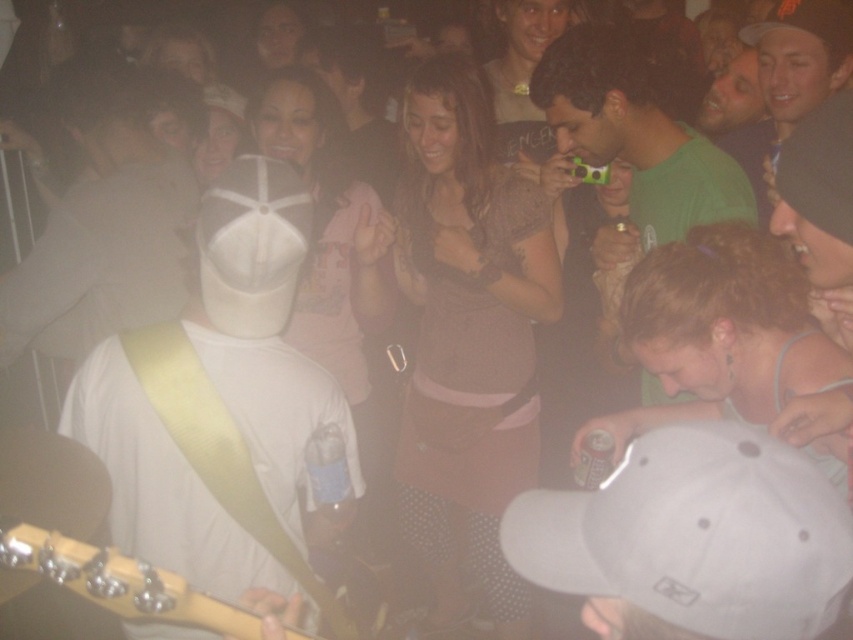
Between white fabric cap at center and smooth black cap at upper right, which one is positioned higher?

smooth black cap at upper right is above.

Is point (195, 493) positioned behind point (793, 29)?

No, (195, 493) is in front of (793, 29).

At what (x,y) coordinates should I click in order to perform the action: click on white fabric cap at center. Please return your answer as a coordinate pair (x, y). Looking at the image, I should click on (218, 403).

Which of these two, white fabric baseball cap at center or green matte camera at center, stands taller?

Standing taller between the two is green matte camera at center.

Does white fabric baseball cap at center lie in front of green matte camera at center?

Yes, it is in front of green matte camera at center.

Where is `white fabric baseball cap at center`? white fabric baseball cap at center is located at coordinates (695, 534).

Image resolution: width=853 pixels, height=640 pixels. What are the coordinates of `white fabric baseball cap at center` in the screenshot? It's located at (695, 534).

Can you confirm if white fabric cap at center is positioned below green matte camera at center?

Correct, white fabric cap at center is located below green matte camera at center.

This screenshot has height=640, width=853. I want to click on white fabric cap at center, so click(218, 403).